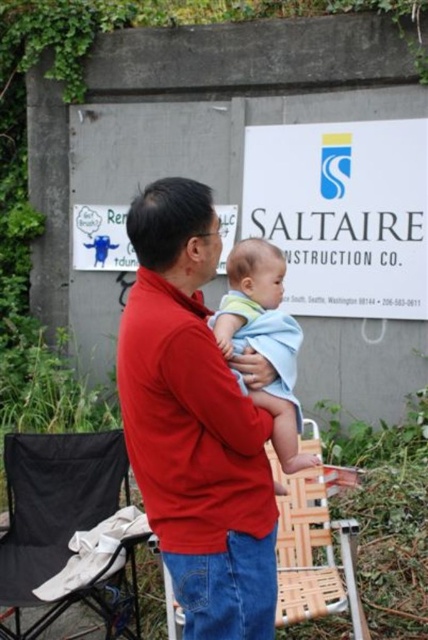
Based on the photo, does wooden at center have a lesser height compared to blue cotton baby at center?

No, wooden at center is not shorter than blue cotton baby at center.

Looking at this image, is wooden at center positioned before blue cotton baby at center?

That is False.

Describe the element at coordinates (314, 552) in the screenshot. The height and width of the screenshot is (640, 428). I see `wooden at center` at that location.

The height and width of the screenshot is (640, 428). I want to click on wooden at center, so click(314, 552).

Between point (142, 356) and point (291, 536), which one is positioned behind?

Point (291, 536)

Who is taller, red cotton shirt at center or wooden at center?

With more height is red cotton shirt at center.

What do you see at coordinates (195, 422) in the screenshot? I see `red cotton shirt at center` at bounding box center [195, 422].

Identify the location of red cotton shirt at center. (195, 422).

Is red cotton shirt at center further to camera compared to black fabric folding chair at lower left?

That is False.

Between red cotton shirt at center and black fabric folding chair at lower left, which one is positioned lower?

black fabric folding chair at lower left

In order to click on red cotton shirt at center in this screenshot , I will do `click(195, 422)`.